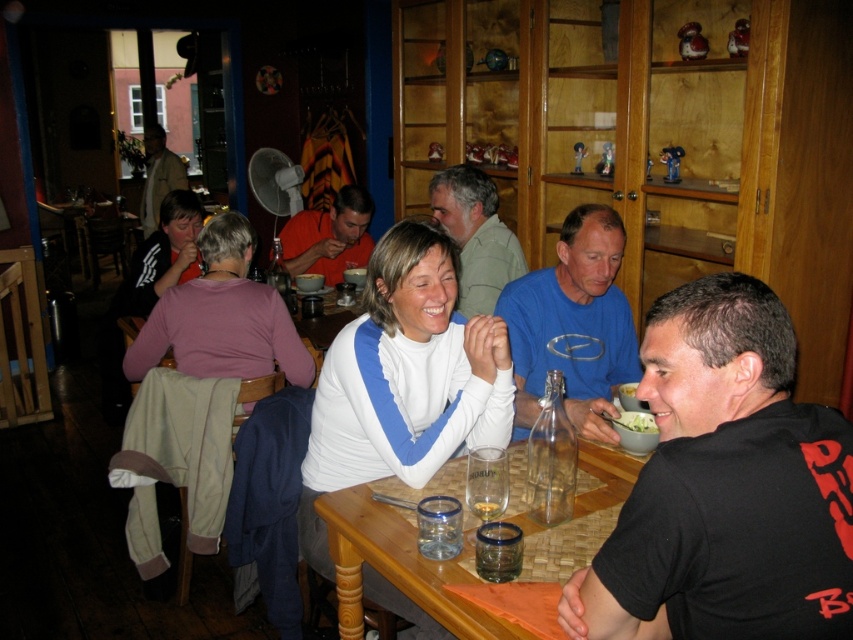
Image resolution: width=853 pixels, height=640 pixels. What do you see at coordinates (329, 236) in the screenshot? I see `orange t-shirt at center` at bounding box center [329, 236].

Is orange t-shirt at center bigger than white matte bowl at upper center?

Yes, orange t-shirt at center is bigger than white matte bowl at upper center.

Locate an element on the screen. The height and width of the screenshot is (640, 853). orange t-shirt at center is located at coordinates (329, 236).

Which of these two, wooden table at center or green leafy salad at lower center, stands shorter?

Standing shorter between the two is green leafy salad at lower center.

Which is behind, point (509, 458) or point (641, 429)?

The point (641, 429) is behind.

Between point (361, 490) and point (645, 413), which one is positioned in front?

Positioned in front is point (361, 490).

Where is `wooden table at center`? wooden table at center is located at coordinates (401, 557).

Who is more forward, (172, 208) or (643, 417)?

Positioned in front is point (643, 417).

Does white matte jacket at upper left appear under green leafy salad at lower center?

No.

Locate an element on the screen. The width and height of the screenshot is (853, 640). white matte jacket at upper left is located at coordinates (161, 256).